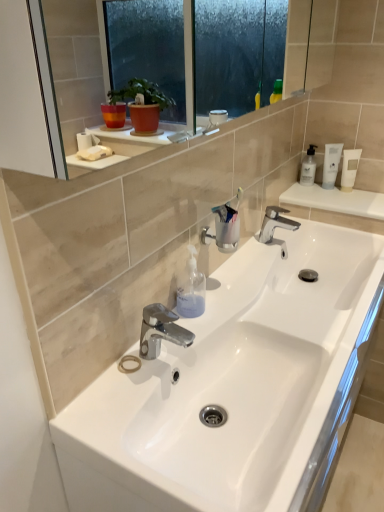
Locate an element on the screen. free space in front of chrome metallic faucet at center, placed as the first tap when sorted from front to back is located at coordinates (126, 416).